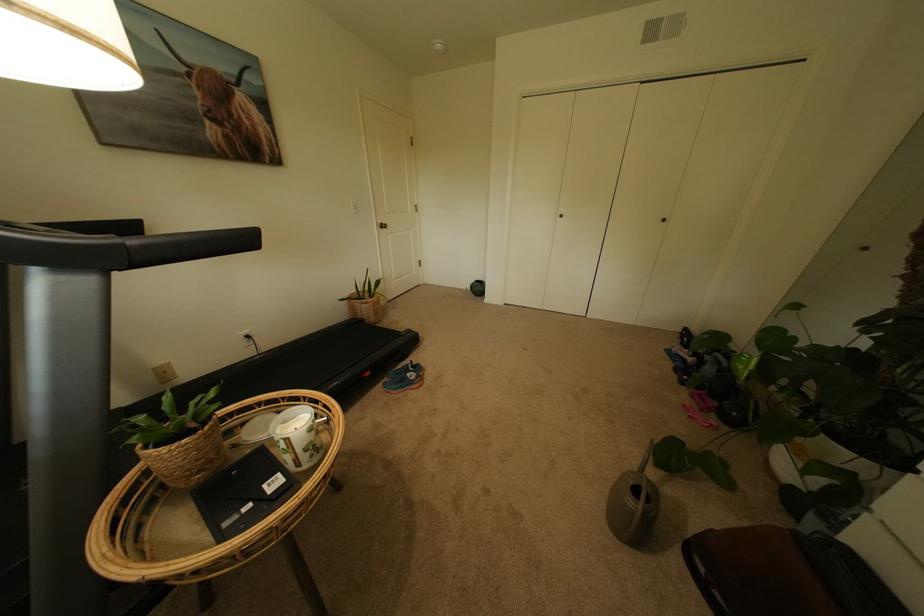
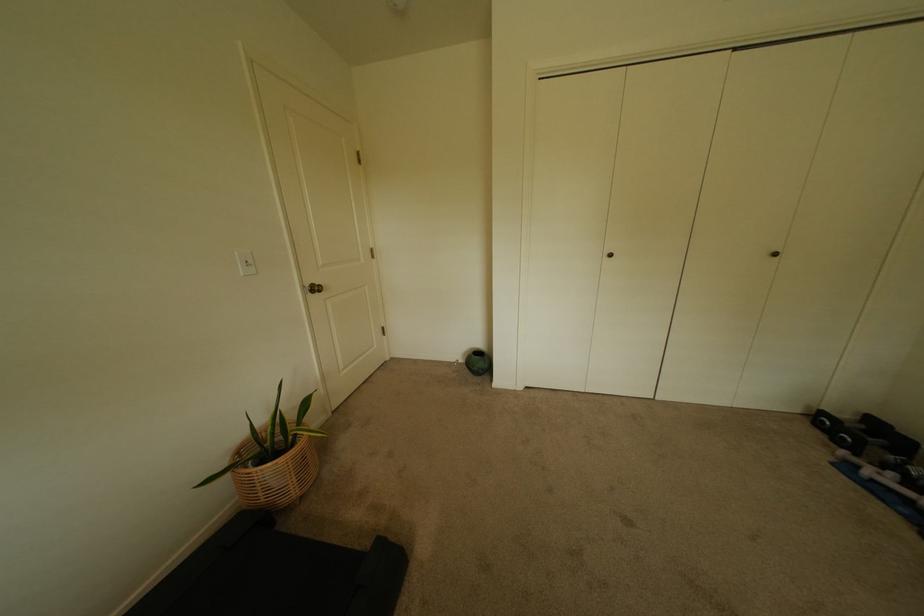
Locate, in the second image, the point that corresponds to (382,314) in the first image.

(302, 480)